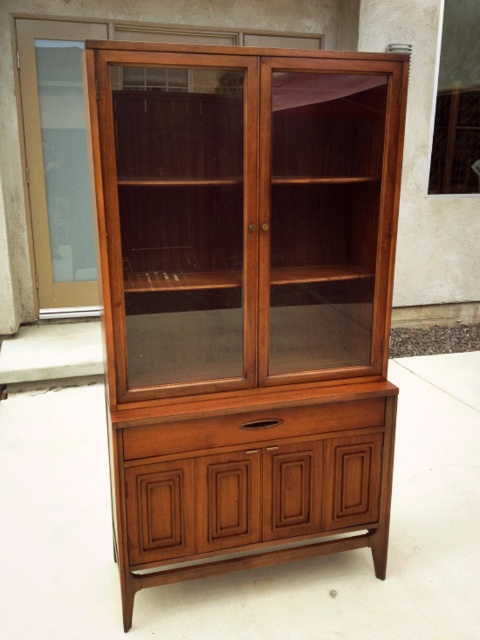
You are standing in front of the wooden cabinet at center and notice the frosted glass door at left. Which object is positioned higher in the image?

The frosted glass door at left is positioned higher because the wooden cabinet at center is located below it.

You are standing in front of the wooden cabinet at center. If you want to place a 1.5 meter long board horizontally on top of it, will it fit? Please explain your reasoning.

The distance between the wooden cabinet at center and the camera is 1.75 meters, but this measurement refers to the depth rather than the width of the cabinet. Since the question asks about placing a board horizontally on top, the relevant measurement would be the cabinet top width. However, the provided information does not specify the cabinet top width. Therefore, it is impossible to determine if the 1.5 meter board will fit based on the given details.

You are a delivery person who needs to place a package between the wooden drawer at center and the frosted glass door at left. The package is 3 meters long. Can it fit in the space between them?

The wooden drawer at center is 3.31 meters from the frosted glass door at left, so the 3 meter long package can fit in the space between them since it is shorter than the distance available.